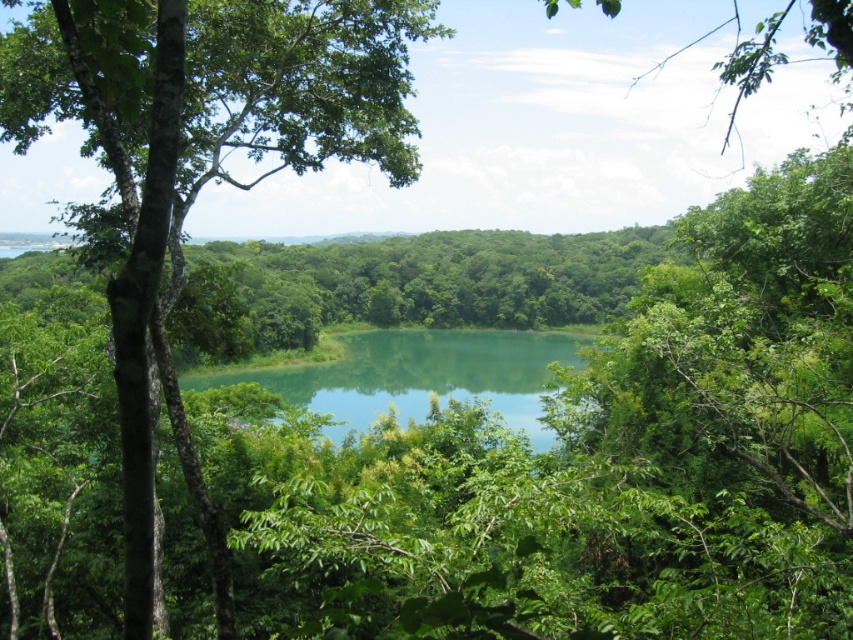
You are a hiker who wants to take a photo of the green leafy tree at center and the green liquid at center. Which object should you focus on first if you want to capture both in a single frame without moving your camera?

The green leafy tree at center is bigger than the green liquid at center, so you should focus on the green leafy tree at center first to ensure it fills the frame appropriately before adjusting for the smaller green liquid at center.

You are a bird flying over the serene landscape. You see the green leafy tree at center and the green liquid at center. Which object is taller?

The green leafy tree at center is taller than the green liquid at center.